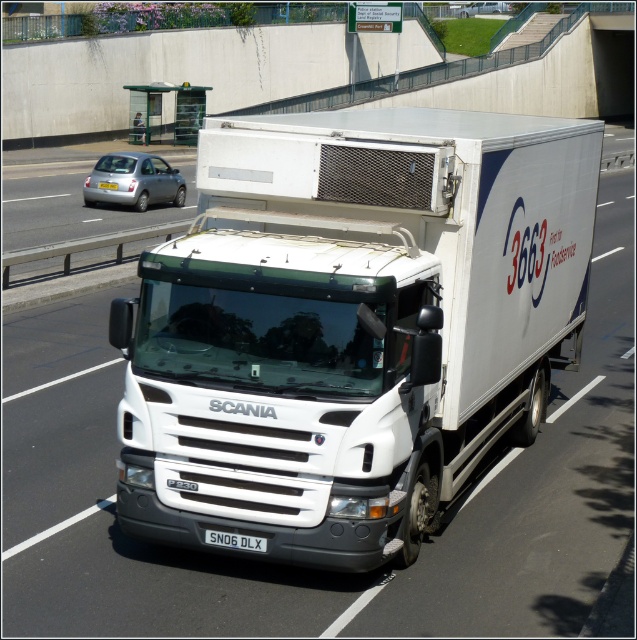
You are a traffic officer observing a white Scania P230 refrigerated lorry on a multi lane road. The truck has two license plates at its center. Which license plate, the black plastic license plate at center or the white plastic license plate at center, is taller?

The white plastic license plate at center is taller than the black plastic license plate at center.

You are a delivery driver who needs to check the distance between the white matte truck at center and the black plastic license plate at center. According to safety guidelines, the minimum safe distance between a vehicle and its license plate must be at least 9 feet. Is the current distance compliant with the guidelines?

The white matte truck at center is 8.58 feet away from the black plastic license plate at center. Since 8.58 feet is less than the required 9 feet, the current distance does not comply with the safety guidelines.

Consider the image. You are a traffic officer observing a white matte truck at center and a black plastic license plate at center. Which object is closer to you from your viewpoint?

The white matte truck at center is closer to you because it is in front of the black plastic license plate at center.